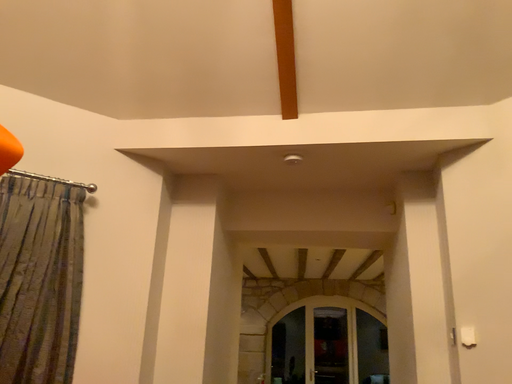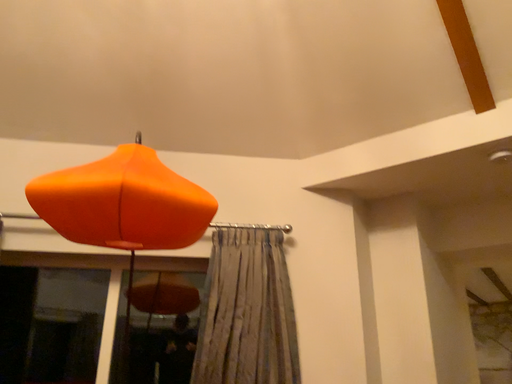
Question: Which way did the camera rotate in the video?

Choices:
 (A) rotated left
 (B) rotated right

Answer: (A)